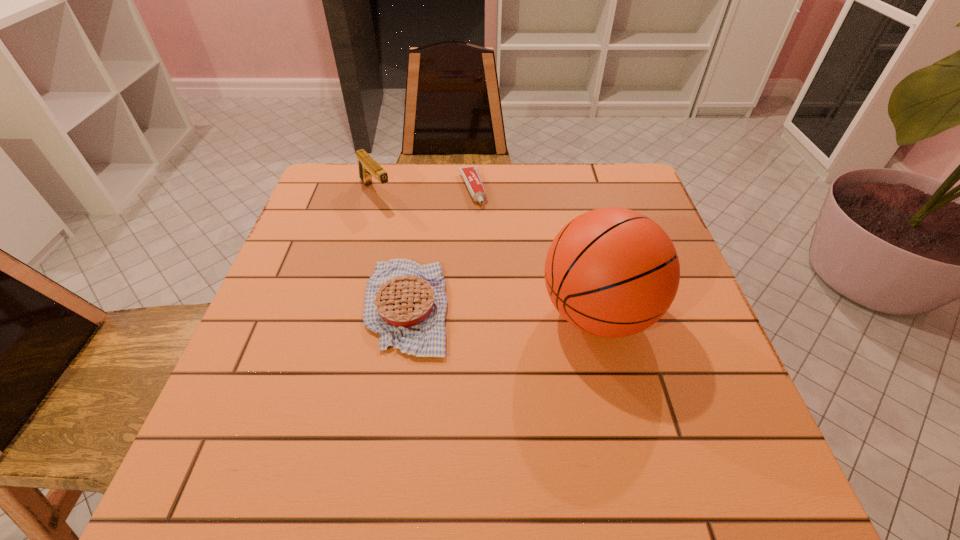
You are a GUI agent. You are given a task and a screenshot of the screen. Output one action in this format:
    pyautogui.click(x=<x>, y=<y>)
    Task: Click on the vacant spot on the desktop that is between the second shortest object and the basketball and is positioned at the barrel of the third shortest object
    This screenshot has height=540, width=960.
    Given the screenshot: What is the action you would take?
    [485, 309]

Identify the location of free spot on the desktop that is between the pie and the tallest object and is positioned at the nozzle of the second object from right to left. (520, 310).